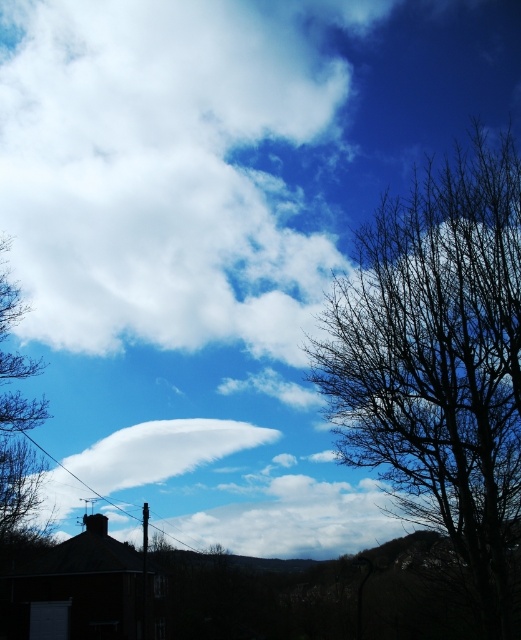
Question: Does bare branches at right have a smaller size compared to white fluffy cloud at center?

Choices:
 (A) yes
 (B) no

Answer: (A)

Question: Which of these objects is positioned closest to the brown leafless tree at left?

Choices:
 (A) bare branches at right
 (B) white fluffy cloud at center

Answer: (B)

Question: Does bare branches at right lie behind white fluffy cloud at center?

Choices:
 (A) yes
 (B) no

Answer: (B)

Question: Is white fluffy cloud at center closer to the viewer compared to brown leafless tree at left?

Choices:
 (A) yes
 (B) no

Answer: (B)

Question: Which object appears farthest from the camera in this image?

Choices:
 (A) white fluffy cloud at center
 (B) bare branches at right

Answer: (A)

Question: Which of the following is the farthest from the observer?

Choices:
 (A) white fluffy cloud at center
 (B) brown leafless tree at left

Answer: (A)